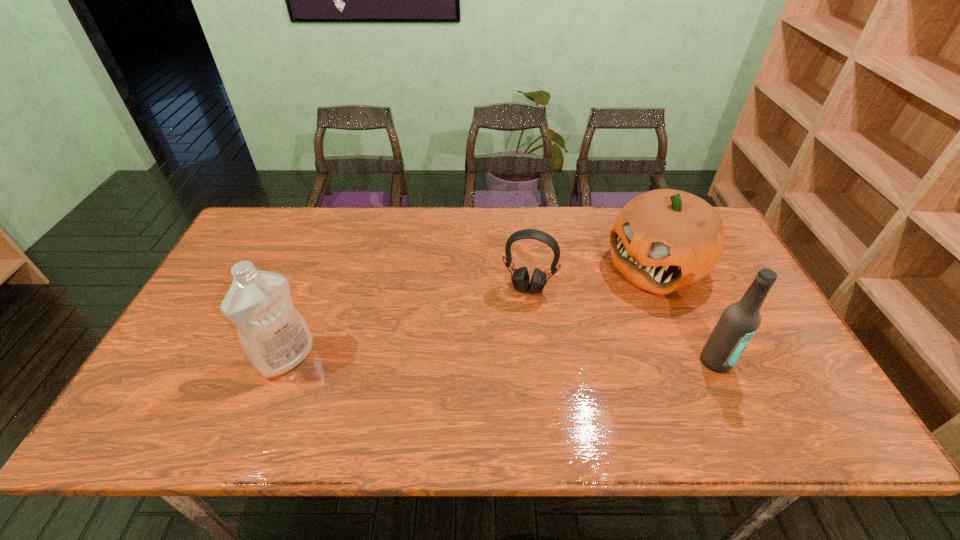
This screenshot has width=960, height=540. Identify the location of free space on the desktop that is between the leftmost object and the beer bottle and is positioned on the face of the second shortest object. (525, 360).

Where is `free spot on the desktop that is between the detergent and the beer bottle and is positioned on the front-facing side of the second object from left to right`? This screenshot has width=960, height=540. free spot on the desktop that is between the detergent and the beer bottle and is positioned on the front-facing side of the second object from left to right is located at coordinates (511, 360).